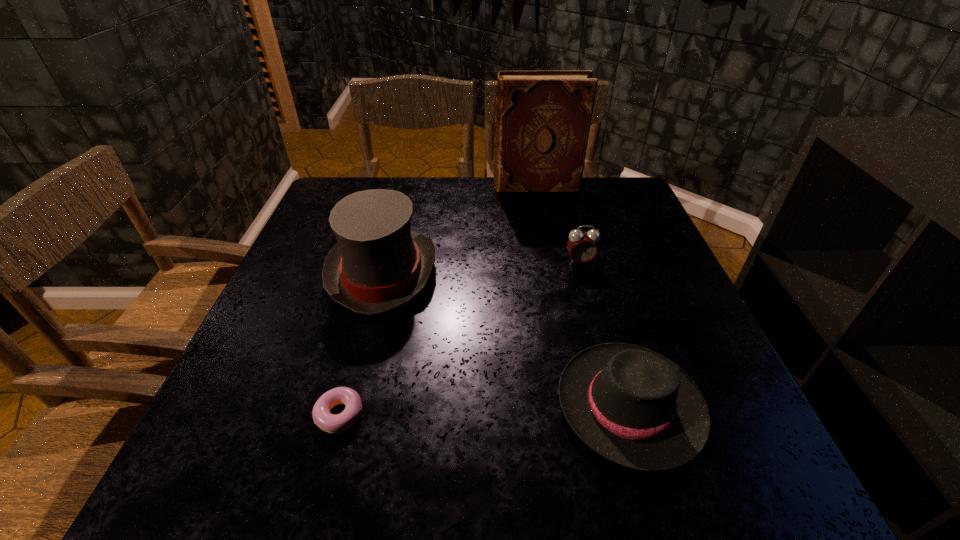
Identify the location of hardback book. (543, 119).

This screenshot has height=540, width=960. In order to click on the farthest object in this screenshot , I will do `click(543, 119)`.

The width and height of the screenshot is (960, 540). In order to click on the fourth shortest object in this screenshot , I will do `click(378, 264)`.

What are the coordinates of `the taller dress hat` in the screenshot? It's located at (378, 264).

Where is `alarm clock`? This screenshot has width=960, height=540. alarm clock is located at coordinates (582, 246).

Locate an element on the screen. The width and height of the screenshot is (960, 540). the nearer dress hat is located at coordinates (633, 406).

Find the location of a particular element. The image size is (960, 540). the right dress hat is located at coordinates (633, 406).

Locate an element on the screen. The image size is (960, 540). doughnut is located at coordinates (332, 423).

Where is `free space located 0.350m on the spine side of the farthest object`? This screenshot has height=540, width=960. free space located 0.350m on the spine side of the farthest object is located at coordinates (376, 186).

Locate an element on the screen. blank space located 0.310m on the spine side of the farthest object is located at coordinates (390, 186).